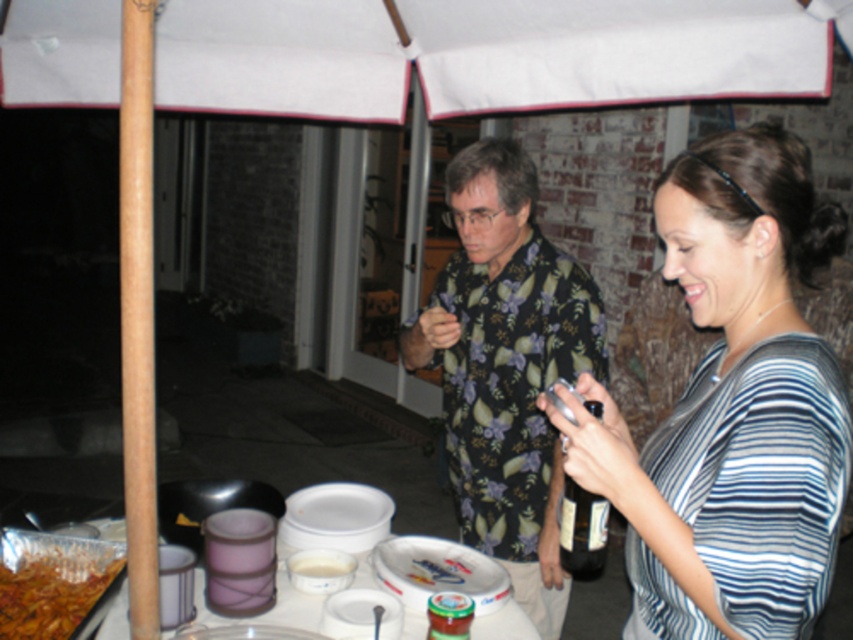
The width and height of the screenshot is (853, 640). I want to click on floral-patterned shirt at center, so tap(506, 365).

Find the location of a particular element. This screenshot has height=640, width=853. floral-patterned shirt at center is located at coordinates (506, 365).

You are a GUI agent. You are given a task and a screenshot of the screen. Output one action in this format:
    pyautogui.click(x=<x>, y=<y>)
    Task: Click on the floral-patterned shirt at center
    
    Given the screenshot: What is the action you would take?
    pyautogui.click(x=506, y=365)

You are a GUI agent. You are given a task and a screenshot of the screen. Output one action in this format:
    pyautogui.click(x=<x>, y=<y>)
    Task: Click on the floral-patterned shirt at center
    This screenshot has width=853, height=640.
    Given the screenshot: What is the action you would take?
    click(506, 365)

What do you see at coordinates (732, 406) in the screenshot? This screenshot has width=853, height=640. I see `striped fabric shirt at center` at bounding box center [732, 406].

Does striped fabric shirt at center have a smaller size compared to white plastic platter at center?

No.

Between point (685, 541) and point (489, 609), which one is positioned in front?

Positioned in front is point (685, 541).

This screenshot has height=640, width=853. I want to click on striped fabric shirt at center, so click(x=732, y=406).